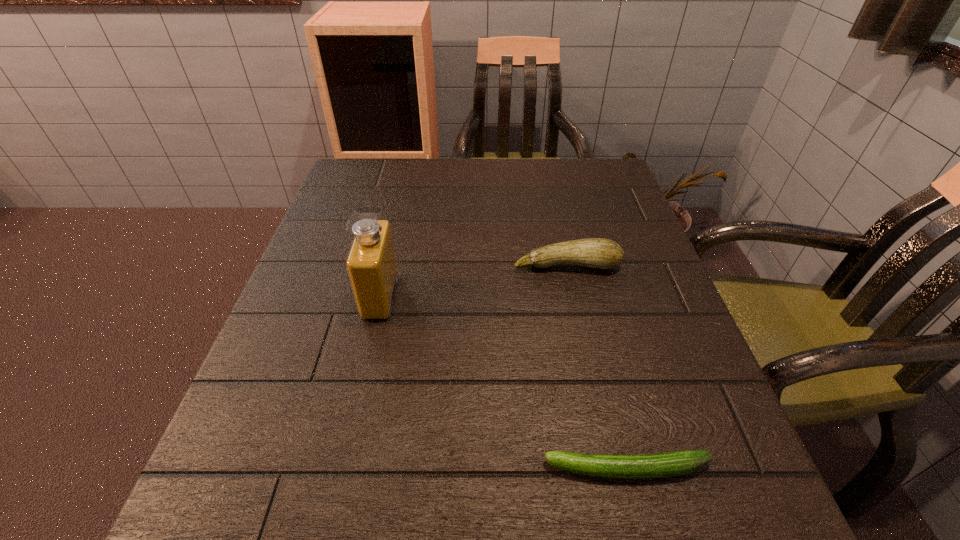
This screenshot has width=960, height=540. I want to click on free space between the shortest object and the farther zucchini, so click(x=597, y=367).

Identify the location of unoccupied position between the shortest object and the leftmost object. (504, 383).

At what (x,y) coordinates should I click in order to perform the action: click on free space between the nearer zucchini and the second tallest object. Please return your answer as a coordinate pair (x, y). Looking at the image, I should click on (597, 367).

Image resolution: width=960 pixels, height=540 pixels. What are the coordinates of `free space between the nearer zucchini and the second shortest object` in the screenshot? It's located at (597, 367).

This screenshot has width=960, height=540. I want to click on vacant area that lies between the taller zucchini and the shortest object, so click(x=597, y=367).

Locate an element on the screen. blank region between the nearer zucchini and the tallest object is located at coordinates (504, 383).

Locate an element on the screen. The height and width of the screenshot is (540, 960). free spot between the taller zucchini and the nearest object is located at coordinates (597, 367).

This screenshot has width=960, height=540. In order to click on vacant area that lies between the second shortest object and the tallest object in this screenshot , I will do `click(473, 281)`.

Image resolution: width=960 pixels, height=540 pixels. I want to click on vacant area that lies between the perfume and the farther zucchini, so click(x=473, y=281).

Identify the location of the second closest object to the shortest object. (599, 253).